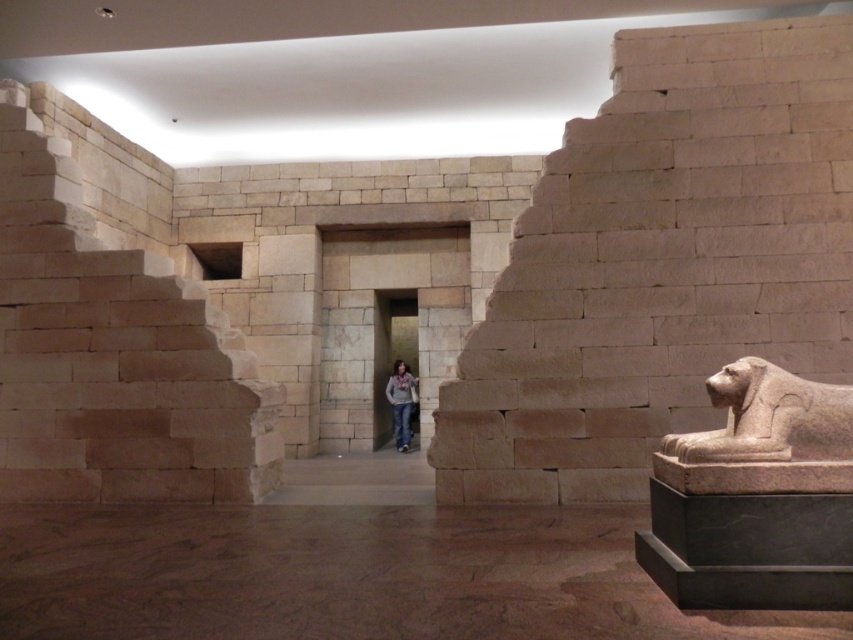
Measure the distance between point (198, 493) and camera.

6.22 meters

Looking at this image, between beige stone stairs at left and light brown leather jacket at center, which one has less height?

light brown leather jacket at center

Between point (62, 339) and point (405, 381), which one is positioned behind?

Positioned behind is point (405, 381).

Find the location of a particular element. This screenshot has width=853, height=640. beige stone stairs at left is located at coordinates (112, 353).

Does beige stone stairs at center lie in front of beige stone stairs at left?

That is True.

How distant is beige stone stairs at center from beige stone stairs at left?

2.60 meters

Who is more distant from viewer, (675,417) or (141,444)?

Point (141,444)

Where is `beige stone stairs at center`? beige stone stairs at center is located at coordinates (660, 262).

Does beige stone stairs at center have a lesser width compared to light brown leather jacket at center?

No.

Is beige stone stairs at center smaller than light brown leather jacket at center?

Actually, beige stone stairs at center might be larger than light brown leather jacket at center.

Is point (662, 202) in front of point (409, 380)?

Yes, it is in front of point (409, 380).

Locate an element on the screen. This screenshot has width=853, height=640. beige stone stairs at center is located at coordinates (660, 262).